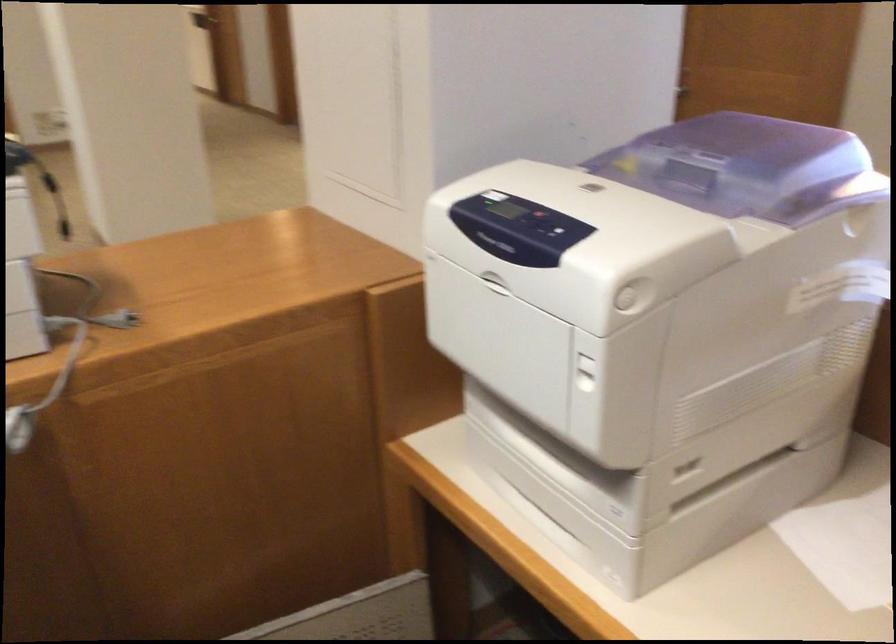
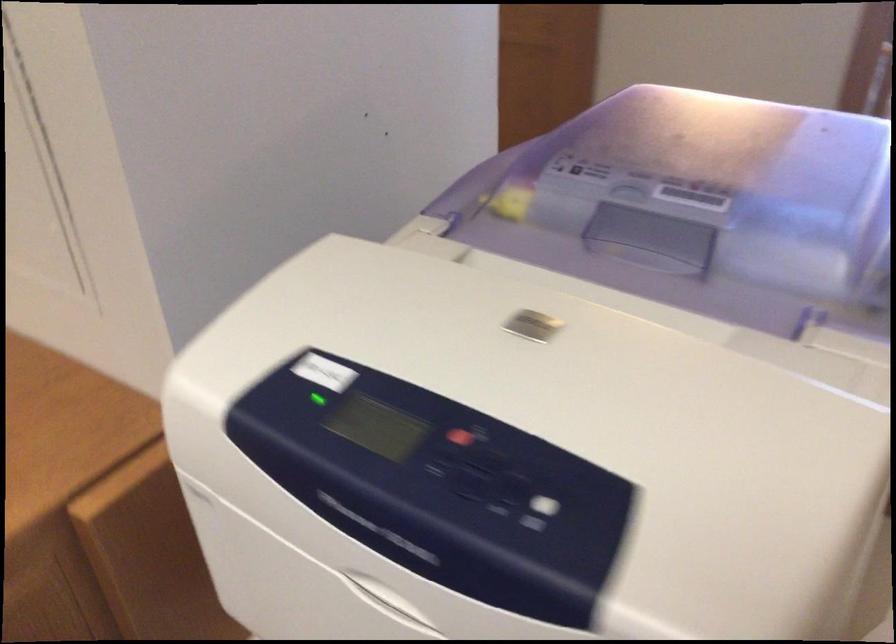
Question: The camera is either moving clockwise (left) or counter-clockwise (right) around the object. The first image is from the beginning of the video and the second image is from the end. Is the camera moving left or right when shooting the video?

Choices:
 (A) Left
 (B) Right

Answer: (A)